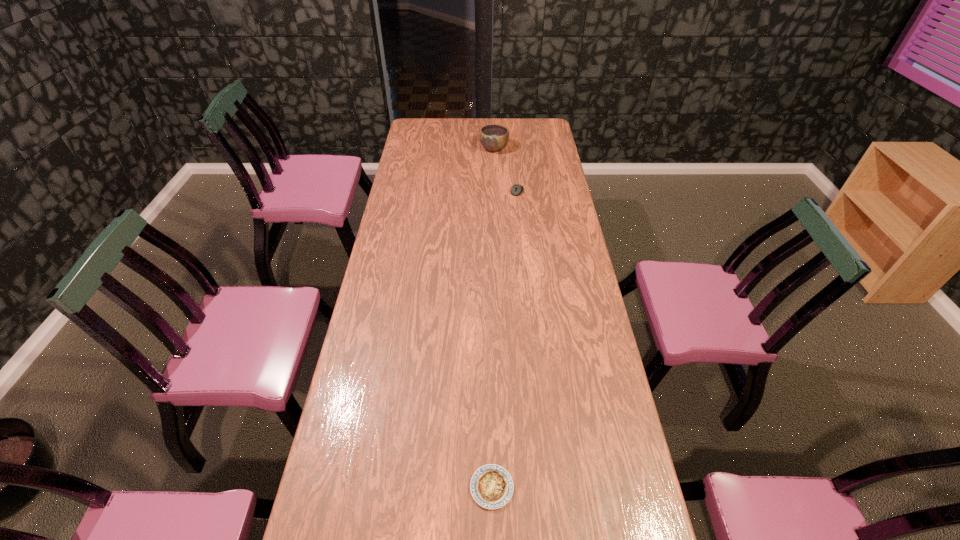
Identify the location of free region at the left edge of the desktop. This screenshot has width=960, height=540. (398, 229).

This screenshot has height=540, width=960. I want to click on vacant space at the right edge of the desktop, so click(x=528, y=144).

Identify the location of vacant area between the nearest object and the second nearest object. (505, 339).

This screenshot has width=960, height=540. I want to click on free point between the second farthest object and the quiche, so click(x=505, y=339).

The image size is (960, 540). I want to click on vacant area that lies between the quiche and the computer equipment, so click(x=505, y=339).

Find the location of a particular element. Image resolution: width=960 pixels, height=540 pixels. empty space that is in between the bowl and the second tallest object is located at coordinates (506, 170).

The image size is (960, 540). In order to click on empty space between the second nearest object and the shortest object in this screenshot , I will do `click(505, 339)`.

Image resolution: width=960 pixels, height=540 pixels. I want to click on free point between the farthest object and the shortest object, so (x=492, y=318).

The height and width of the screenshot is (540, 960). I want to click on vacant space in between the computer equipment and the bowl, so click(506, 170).

Identify the location of vacant point located between the bowl and the quiche. The image size is (960, 540). (492, 318).